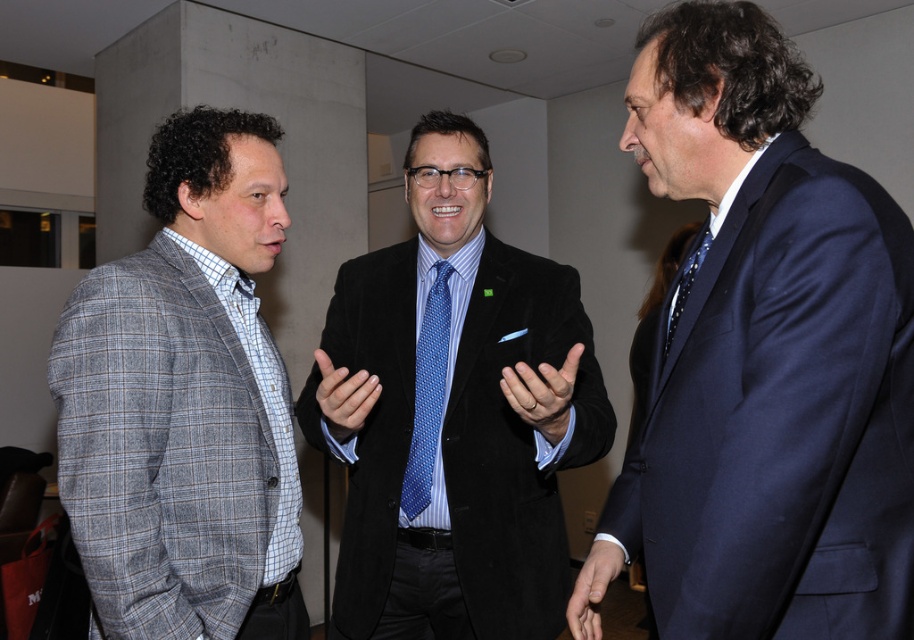
Can you confirm if navy blue suit at right is positioned above gray plaid blazer at left?

Correct, navy blue suit at right is located above gray plaid blazer at left.

Consider the image. Does navy blue suit at right come in front of gray plaid blazer at left?

Yes, navy blue suit at right is closer to the viewer.

At what (x,y) coordinates should I click in order to perform the action: click on navy blue suit at right. Please return your answer as a coordinate pair (x, y). The height and width of the screenshot is (640, 914). Looking at the image, I should click on (764, 358).

Identify the location of navy blue suit at right. This screenshot has height=640, width=914. (764, 358).

Which is more to the right, navy blue suit at right or polka dot silk tie at center?

navy blue suit at right is more to the right.

Image resolution: width=914 pixels, height=640 pixels. Find the location of `navy blue suit at right`. navy blue suit at right is located at coordinates (764, 358).

Locate an element on the screen. This screenshot has width=914, height=640. navy blue suit at right is located at coordinates (764, 358).

Between gray plaid blazer at left and polka dot silk tie at center, which one has less height?

polka dot silk tie at center

Who is positioned more to the left, gray plaid blazer at left or polka dot silk tie at center?

gray plaid blazer at left is more to the left.

Between point (96, 348) and point (677, 321), which one is positioned in front?

Point (677, 321) is in front.

Locate an element on the screen. Image resolution: width=914 pixels, height=640 pixels. gray plaid blazer at left is located at coordinates (186, 401).